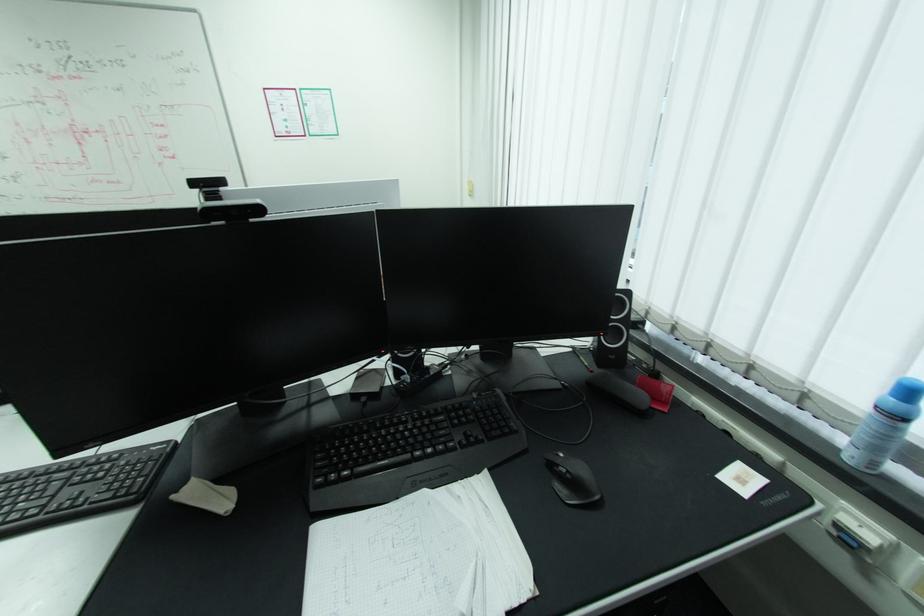
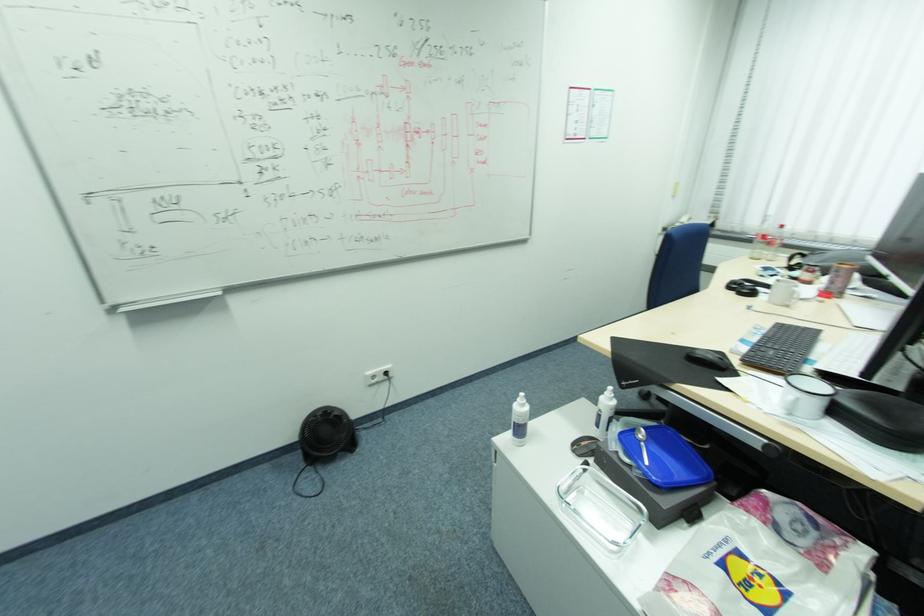
Question: What movement of the cameraman would produce the second image?

Choices:
 (A) Left
 (B) Right
 (C) Forward
 (D) Backward

Answer: (A)